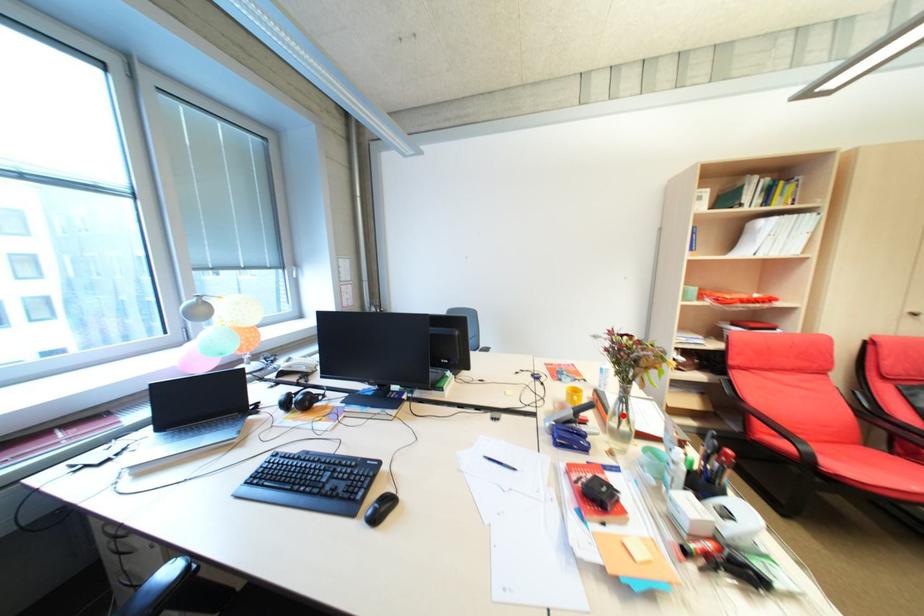
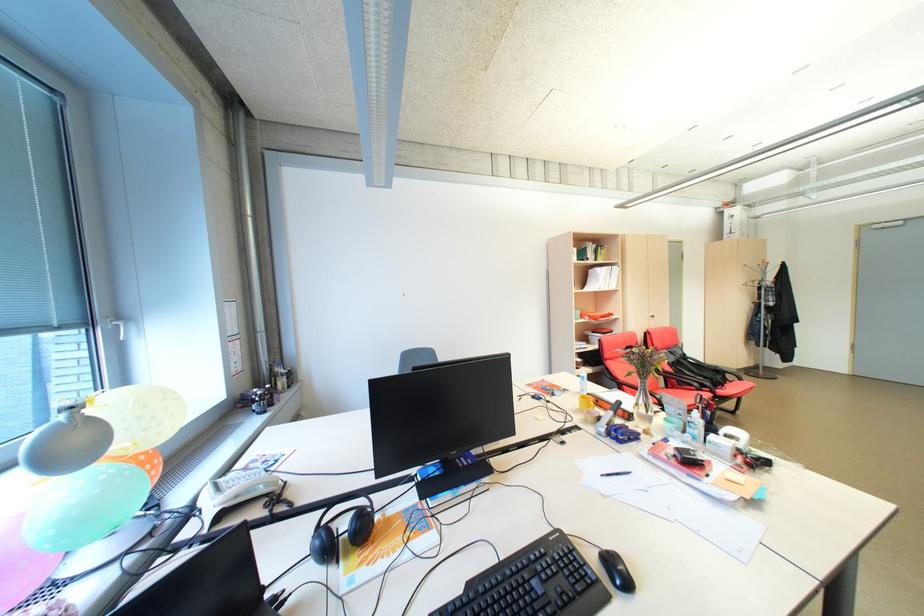
Where in the second image is the point corresponding to the highlighted location from the first image?

(646, 406)